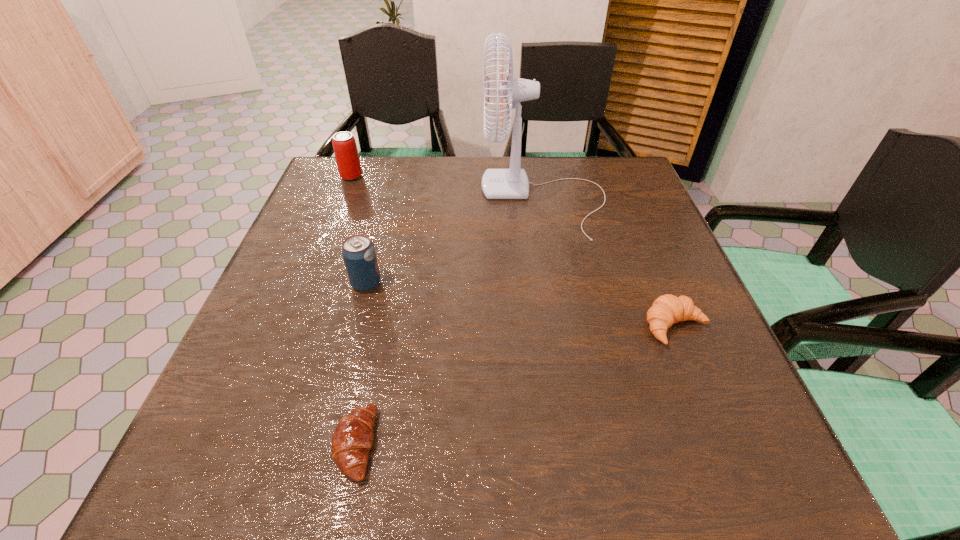
Where is `unoccupied area between the left crescent roll and the taller crescent roll`? The height and width of the screenshot is (540, 960). unoccupied area between the left crescent roll and the taller crescent roll is located at coordinates pyautogui.click(x=516, y=386).

You are a GUI agent. You are given a task and a screenshot of the screen. Output one action in this format:
    pyautogui.click(x=<x>, y=<y>)
    Task: Click on the free space between the beer can and the fan
    The height and width of the screenshot is (540, 960).
    Given the screenshot: What is the action you would take?
    pyautogui.click(x=447, y=188)

Find the location of a particular element. free space between the taller crescent roll and the beer can is located at coordinates point(514,252).

Where is `vacant space in between the tallest object and the leftmost object`? vacant space in between the tallest object and the leftmost object is located at coordinates (447, 188).

Where is `vacant space that is in between the second nearest object and the left crescent roll`? The image size is (960, 540). vacant space that is in between the second nearest object and the left crescent roll is located at coordinates (516, 386).

Where is `vacant area between the fourth farthest object and the left crescent roll`? The width and height of the screenshot is (960, 540). vacant area between the fourth farthest object and the left crescent roll is located at coordinates (516, 386).

At what (x,y) coordinates should I click in order to perform the action: click on empty space between the second shortest object and the third nearest object. Please return your answer as a coordinate pair (x, y). Looking at the image, I should click on (521, 305).

This screenshot has width=960, height=540. I want to click on free space between the beer can and the second shortest object, so click(x=514, y=252).

Locate which object is the second closest to the beer can. Please provide its 2D coordinates. Your answer should be formatted as a tuple, i.e. [(x, y)], where the tuple contains the x and y coordinates of a point satisfying the conditions above.

[(358, 252)]

Locate an element on the screen. object that is the second nearest to the right crescent roll is located at coordinates (353, 437).